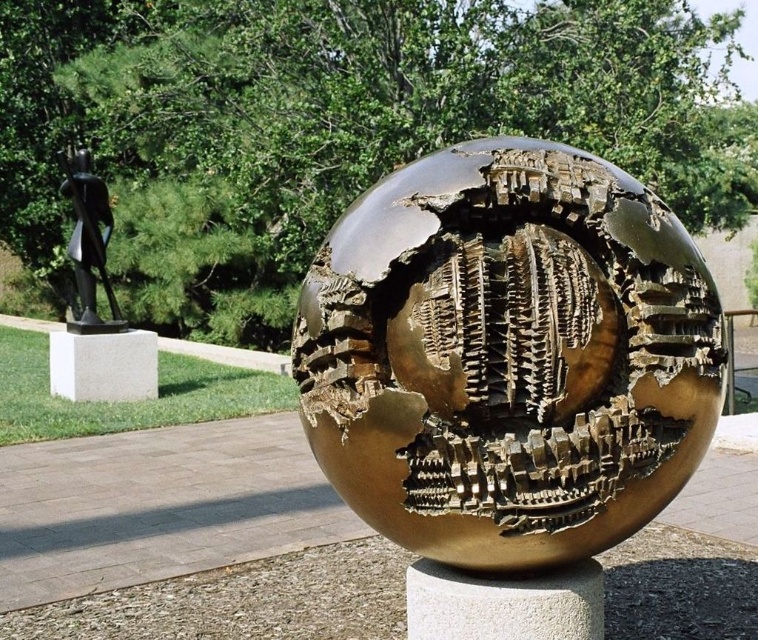
What is located at the coordinates point (503, 602) in the sculpture garden?

The white stone pillar at center is located at point (503, 602).

You are standing in the sculpture garden and want to take a photo of both the white stone pillar at center and the white marble pillar at lower left. Which pillar should you position yourself closer to in order to capture both pillars in the same frame?

The white stone pillar at center is below the white marble pillar at lower left, so positioning yourself closer to the white marble pillar at lower left will allow you to include both pillars in your photo since the lower pillar is further away and the upper one is closer.

You are an art student measuring the sculptures for a project. You have a ruler that can only measure up to 2 meters. If the white marble pillar at lower left is 1.8 meters wide, can you accurately measure the gold textured sphere at center with your ruler?

The gold textured sphere at center has a width less than the white marble pillar at lower left, which is 1.8 meters wide. Since the sphere is narrower, your ruler that measures up to 2 meters can accommodate its width, allowing you to measure it accurately.